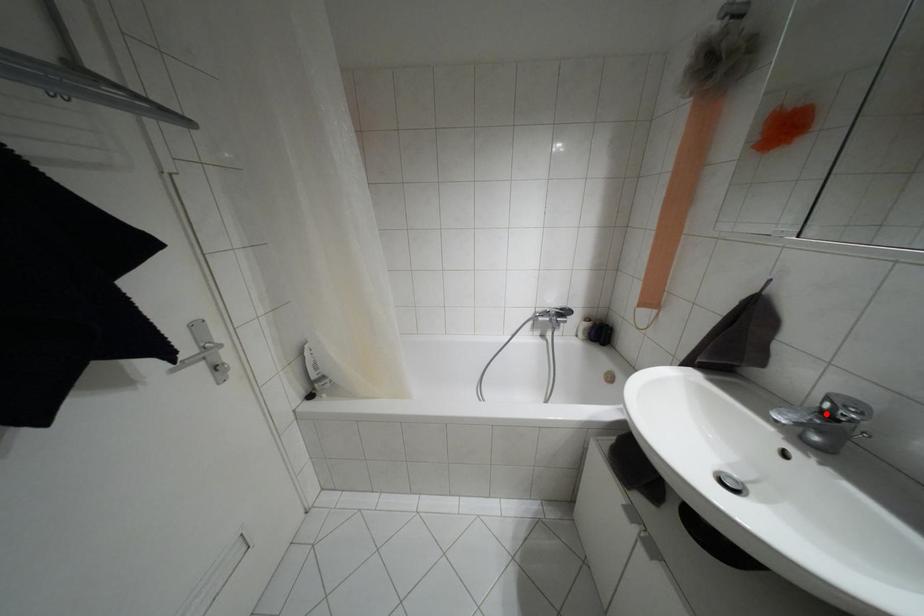
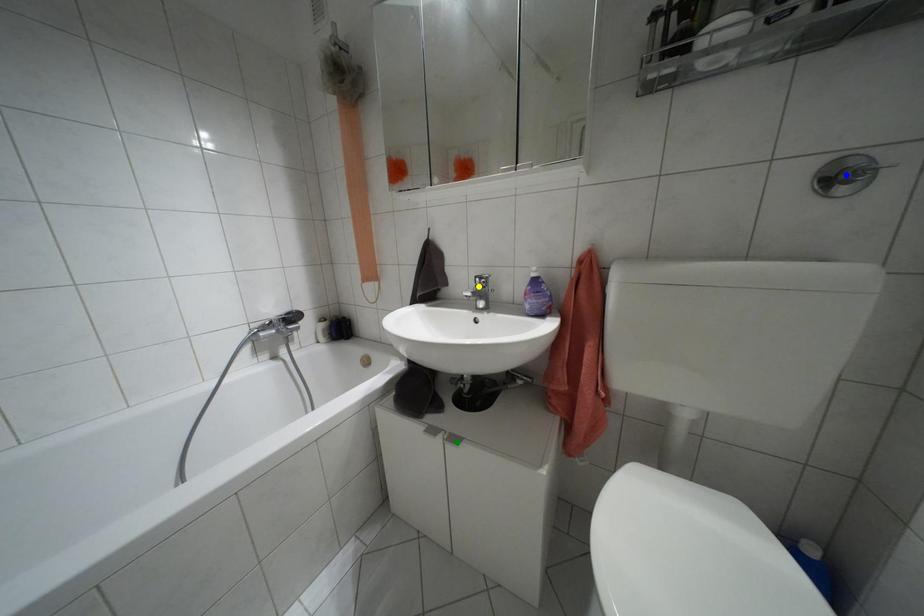
Question: I am providing you with two images of the same scene from different viewpoints. A red point is marked on the first image. You are given multiple points on the second image. Can you choose the point in image 2 that corresponds to the point in image 1?

Choices:
 (A) blue point
 (B) green point
 (C) yellow point

Answer: (C)